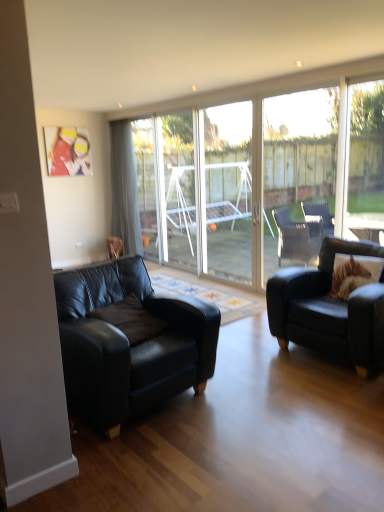
Locate an element on the screen. This screenshot has height=512, width=384. vacant space in front of black leather couch at left, which appears as the second studio couch when viewed from the right is located at coordinates (158, 467).